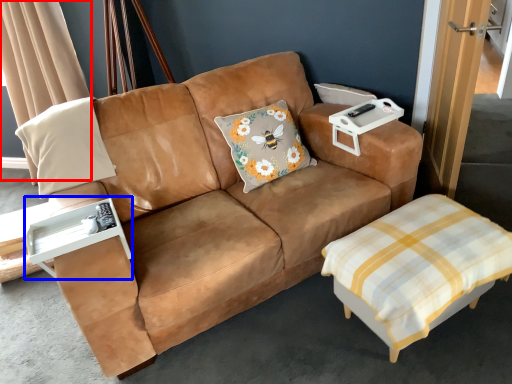
Question: Among these objects, which one is nearest to the camera, curtain (highlighted by a red box) or side table (highlighted by a blue box)?

Choices:
 (A) curtain
 (B) side table

Answer: (B)